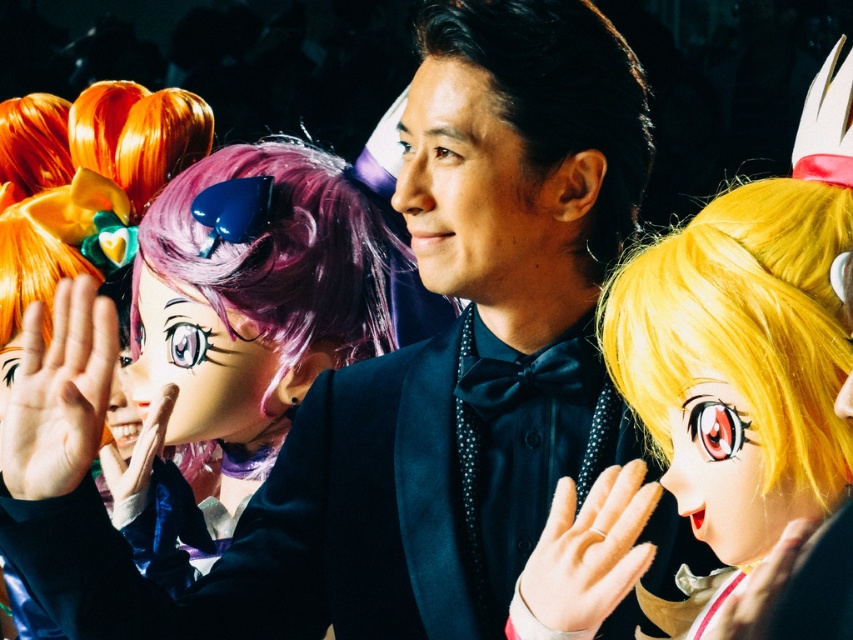
Is smooth skin face at center taller than black shiny hair at center?

In fact, smooth skin face at center may be shorter than black shiny hair at center.

Can you confirm if smooth skin face at center is positioned to the left of black shiny hair at center?

Indeed, smooth skin face at center is positioned on the left side of black shiny hair at center.

Is point (497, 212) closer to viewer compared to point (636, 65)?

Yes, it is in front of point (636, 65).

You are a GUI agent. You are given a task and a screenshot of the screen. Output one action in this format:
    pyautogui.click(x=<x>, y=<y>)
    Task: Click on the smooth skin face at center
    
    Given the screenshot: What is the action you would take?
    pyautogui.click(x=474, y=193)

Can you confirm if purple matte wig at center is wider than shiny gold wig at center?

Indeed, purple matte wig at center has a greater width compared to shiny gold wig at center.

Is purple matte wig at center smaller than shiny gold wig at center?

Actually, purple matte wig at center might be larger than shiny gold wig at center.

Between point (219, 378) and point (714, 490), which one is positioned behind?

The point (219, 378) is more distant.

At what (x,y) coordinates should I click in order to perform the action: click on purple matte wig at center. Please return your answer as a coordinate pair (x, y). Image resolution: width=853 pixels, height=640 pixels. Looking at the image, I should click on (202, 368).

Who is lower down, shiny purple wig at center or smooth plastic mask at center?

smooth plastic mask at center is lower down.

This screenshot has width=853, height=640. Describe the element at coordinates (227, 397) in the screenshot. I see `shiny purple wig at center` at that location.

This screenshot has width=853, height=640. What are the coordinates of `shiny purple wig at center` in the screenshot? It's located at (227, 397).